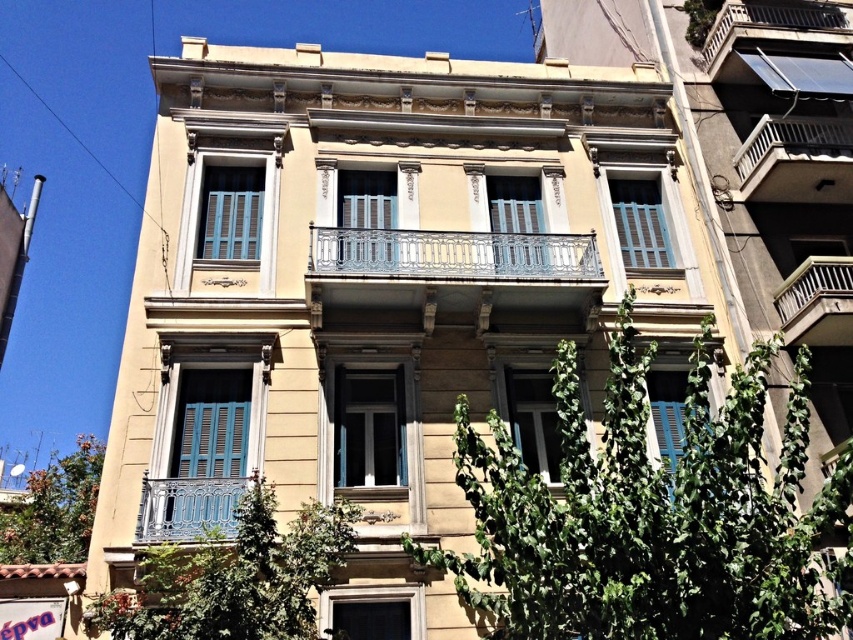
Question: Does metallic wrought iron balcony at upper right have a larger size compared to metallic wrought iron balcony at right?

Choices:
 (A) no
 (B) yes

Answer: (B)

Question: Among these points, which one is nearest to the camera?

Choices:
 (A) (709, 54)
 (B) (845, 317)
 (C) (573, 269)
 (D) (786, 124)

Answer: (B)

Question: Which object is closer to the camera taking this photo?

Choices:
 (A) metallic wrought iron balcony at upper right
 (B) metallic wrought iron balcony at center
 (C) metallic silver balcony at upper right

Answer: (B)

Question: Which point appears closest to the camera in this image?

Choices:
 (A) (775, 154)
 (B) (756, 12)
 (C) (331, 240)

Answer: (C)

Question: Is metallic wrought iron balcony at center closer to camera compared to metallic wrought iron balcony at right?

Choices:
 (A) no
 (B) yes

Answer: (B)

Question: Does metallic wrought iron balcony at center come behind metallic wrought iron balcony at right?

Choices:
 (A) yes
 (B) no

Answer: (B)